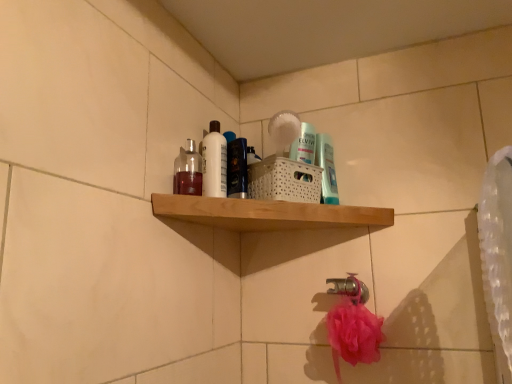
Question: Is silver metallic faucet at lower center further to the viewer compared to shiny blue bottle at center?

Choices:
 (A) yes
 (B) no

Answer: (A)

Question: Does silver metallic faucet at lower center have a larger size compared to shiny blue bottle at center?

Choices:
 (A) yes
 (B) no

Answer: (B)

Question: Can shiny blue bottle at center be found inside silver metallic faucet at lower center?

Choices:
 (A) no
 (B) yes

Answer: (A)

Question: Is the position of silver metallic faucet at lower center less distant than that of shiny blue bottle at center?

Choices:
 (A) no
 (B) yes

Answer: (A)

Question: Can you confirm if silver metallic faucet at lower center is thinner than shiny blue bottle at center?

Choices:
 (A) yes
 (B) no

Answer: (A)

Question: From the image's perspective, is silver metallic faucet at lower center located beneath shiny blue bottle at center?

Choices:
 (A) yes
 (B) no

Answer: (A)

Question: Is white glossy bottle at upper center not inside translucent glass bottle at upper left, which is counted as the 2th mouthwash, starting from the back?

Choices:
 (A) no
 (B) yes

Answer: (B)

Question: From the image's perspective, is white glossy bottle at upper center beneath translucent glass bottle at upper left, which is the first mouthwash in front-to-back order?

Choices:
 (A) no
 (B) yes

Answer: (A)

Question: From a real-world perspective, is white glossy bottle at upper center over translucent glass bottle at upper left, the second mouthwash in the right-to-left sequence?

Choices:
 (A) yes
 (B) no

Answer: (A)

Question: From the image's perspective, would you say white glossy bottle at upper center is positioned over translucent glass bottle at upper left, which is the first mouthwash in front-to-back order?

Choices:
 (A) no
 (B) yes

Answer: (B)

Question: Is white glossy bottle at upper center shorter than translucent glass bottle at upper left, the 1th mouthwash positioned from the left?

Choices:
 (A) no
 (B) yes

Answer: (A)

Question: Is white glossy bottle at upper center wider than translucent glass bottle at upper left, the 1th mouthwash positioned from the left?

Choices:
 (A) yes
 (B) no

Answer: (B)

Question: From a real-world perspective, is shiny blue bottle at center located beneath white glossy bottle at upper center?

Choices:
 (A) yes
 (B) no

Answer: (A)